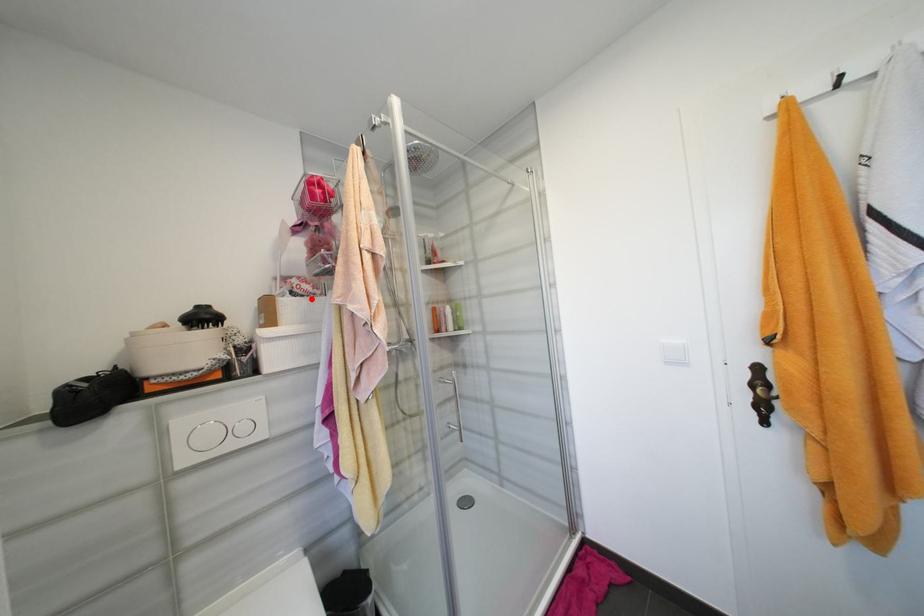
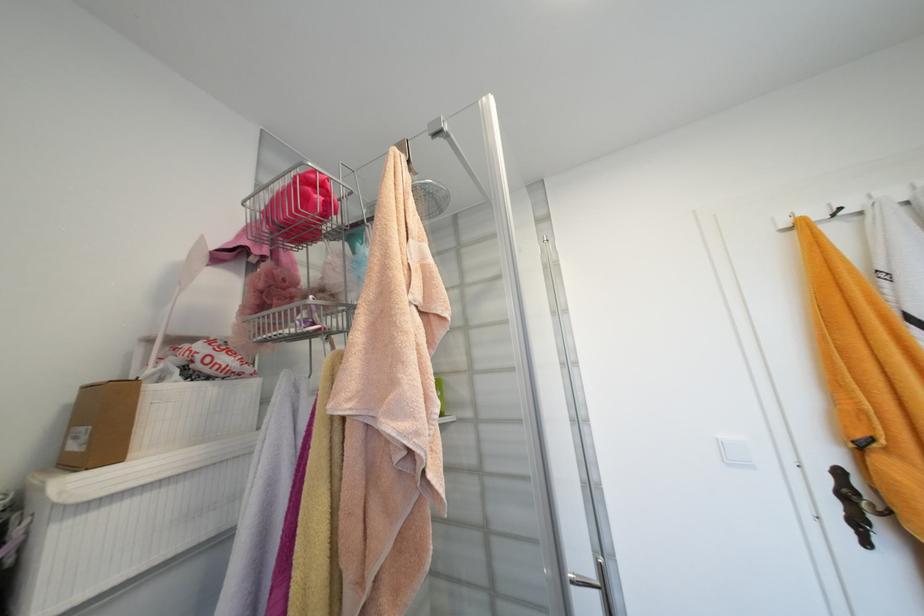
The point at the highlighted location is marked in the first image. Where is the corresponding point in the second image?

(224, 383)